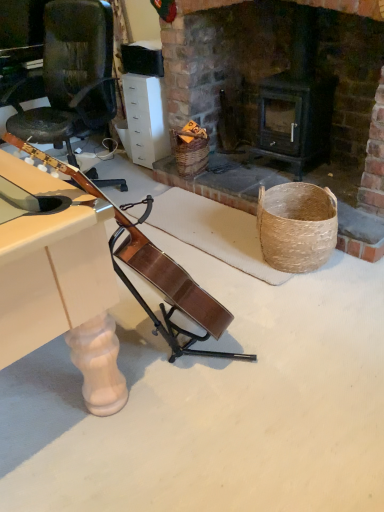
Locate an element on the screen. The image size is (384, 512). woven brown basket at center is located at coordinates (189, 153).

What do you see at coordinates (189, 153) in the screenshot? This screenshot has width=384, height=512. I see `woven brown basket at center` at bounding box center [189, 153].

Locate an element on the screen. This screenshot has width=384, height=512. white glossy drawer at upper center is located at coordinates (146, 118).

Image resolution: width=384 pixels, height=512 pixels. What do you see at coordinates (146, 118) in the screenshot?
I see `white glossy drawer at upper center` at bounding box center [146, 118].

At what (x,y) coordinates should I click in order to perform the action: click on woven brown basket at center. Please return your answer as a coordinate pair (x, y). Looking at the image, I should click on (189, 153).

Based on their positions, is white glossy drawer at upper center located to the left or right of woven brown basket at center?

In the image, white glossy drawer at upper center appears on the left side of woven brown basket at center.

Does white glossy drawer at upper center come behind woven brown basket at center?

Yes, white glossy drawer at upper center is further from the viewer.

Between point (130, 144) and point (188, 173), which one is positioned behind?

The point (130, 144) is farther from the camera.

From the image's perspective, is white glossy drawer at upper center on top of woven brown basket at center?

A: Yes.

From a real-world perspective, is white glossy drawer at upper center positioned above or below woven brown basket at center?

From a real-world perspective, white glossy drawer at upper center is physically above woven brown basket at center.

Looking at this image, can you confirm if white glossy drawer at upper center is thinner than woven brown basket at center?

In fact, white glossy drawer at upper center might be wider than woven brown basket at center.

Considering the sizes of white glossy drawer at upper center and woven brown basket at center in the image, is white glossy drawer at upper center taller or shorter than woven brown basket at center?

Considering their sizes, white glossy drawer at upper center has more height than woven brown basket at center.

In the scene shown: Which of these two, white glossy drawer at upper center or woven brown basket at center, is bigger?

white glossy drawer at upper center is bigger.

Is white glossy drawer at upper center not inside woven brown basket at center?

white glossy drawer at upper center lies outside woven brown basket at center's area.

Is white glossy drawer at upper center positioned far away from woven brown basket at center?

They are positioned close to each other.

Is white glossy drawer at upper center oriented away from woven brown basket at center?

No, woven brown basket at center is not at the back of white glossy drawer at upper center.

Can you tell me how much white glossy drawer at upper center and woven brown basket at center differ in facing direction?

white glossy drawer at upper center and woven brown basket at center are facing 0.28 degrees away from each other.

This screenshot has width=384, height=512. Find the location of `drawer behind the woven brown basket at center`. drawer behind the woven brown basket at center is located at coordinates (146, 118).

Considering the relative positions of woven brown basket at center and white glossy drawer at upper center in the image provided, is woven brown basket at center to the left or to the right of white glossy drawer at upper center?

In the image, woven brown basket at center appears on the right side of white glossy drawer at upper center.

Is woven brown basket at center closer to camera compared to white glossy drawer at upper center?

Yes, woven brown basket at center is in front of white glossy drawer at upper center.

Which point is more forward, (x=177, y=135) or (x=161, y=141)?

The point (x=177, y=135) is closer.

From the image's perspective, between woven brown basket at center and white glossy drawer at upper center, which one is located above?

white glossy drawer at upper center.

From a real-world perspective, is woven brown basket at center below white glossy drawer at upper center?

Indeed, from a real-world perspective, woven brown basket at center is positioned beneath white glossy drawer at upper center.

Based on the photo, looking at their sizes, would you say woven brown basket at center is wider or thinner than white glossy drawer at upper center?

woven brown basket at center is thinner than white glossy drawer at upper center.

Is woven brown basket at center taller than white glossy drawer at upper center?

Incorrect, the height of woven brown basket at center is not larger of that of white glossy drawer at upper center.

Is woven brown basket at center smaller than white glossy drawer at upper center?

Yes, woven brown basket at center is smaller than white glossy drawer at upper center.

Choose the correct answer: Is woven brown basket at center inside white glossy drawer at upper center or outside it?

woven brown basket at center lies outside white glossy drawer at upper center.

Is woven brown basket at center not near white glossy drawer at upper center?

No, woven brown basket at center is not far away from white glossy drawer at upper center.

Is woven brown basket at center positioned with its back to white glossy drawer at upper center?

That's not correct — woven brown basket at center is not looking away from white glossy drawer at upper center.

At what (x,y) coordinates should I click in order to perform the action: click on basket lying below the white glossy drawer at upper center (from the image's perspective). Please return your answer as a coordinate pair (x, y). Image resolution: width=384 pixels, height=512 pixels. Looking at the image, I should click on (189, 153).

Identify the location of drawer on the left of woven brown basket at center. (146, 118).

Identify the location of drawer behind the woven brown basket at center. (146, 118).